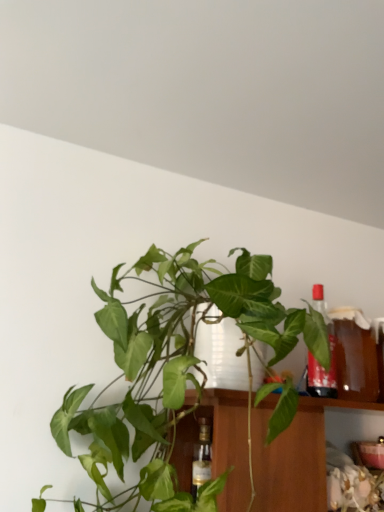
This screenshot has width=384, height=512. What do you see at coordinates (174, 365) in the screenshot? I see `green leafy plant at center` at bounding box center [174, 365].

Find the location of a particular element. The height and width of the screenshot is (512, 384). green leafy plant at center is located at coordinates (174, 365).

Where is `translucent glass bottle at upper right`? translucent glass bottle at upper right is located at coordinates (317, 361).

The width and height of the screenshot is (384, 512). What do you see at coordinates (317, 361) in the screenshot?
I see `translucent glass bottle at upper right` at bounding box center [317, 361].

Find the location of a particular element. The height and width of the screenshot is (512, 384). green leafy plant at center is located at coordinates (174, 365).

Does green leafy plant at center appear on the left side of translucent glass bottle at upper right?

Yes, green leafy plant at center is to the left of translucent glass bottle at upper right.

Consider the image. In the image, is green leafy plant at center positioned in front of or behind translucent glass bottle at upper right?

Clearly, green leafy plant at center is in front of translucent glass bottle at upper right.

Between point (205, 266) and point (308, 367), which one is positioned in front?

The point (308, 367) is in front.

From the image's perspective, is green leafy plant at center beneath translucent glass bottle at upper right?

No, from the image's perspective, green leafy plant at center is not below translucent glass bottle at upper right.

From a real-world perspective, is green leafy plant at center over translucent glass bottle at upper right?

No, from a real-world perspective, green leafy plant at center is not above translucent glass bottle at upper right.

Considering the sizes of objects green leafy plant at center and translucent glass bottle at upper right in the image provided, who is wider, green leafy plant at center or translucent glass bottle at upper right?

green leafy plant at center is wider.

Based on the photo, can you confirm if green leafy plant at center is taller than translucent glass bottle at upper right?

Indeed, green leafy plant at center has a greater height compared to translucent glass bottle at upper right.

Can you confirm if green leafy plant at center is smaller than translucent glass bottle at upper right?

No, green leafy plant at center is not smaller than translucent glass bottle at upper right.

Is green leafy plant at center not within translucent glass bottle at upper right?

Yes, green leafy plant at center is outside of translucent glass bottle at upper right.

Is green leafy plant at center beside translucent glass bottle at upper right?

No, green leafy plant at center is not with translucent glass bottle at upper right.

Is green leafy plant at center facing away from translucent glass bottle at upper right?

No, green leafy plant at center is not facing away from translucent glass bottle at upper right.

How much distance is there between green leafy plant at center and translucent glass bottle at upper right?

A distance of 14.21 inches exists between green leafy plant at center and translucent glass bottle at upper right.

This screenshot has height=512, width=384. Find the location of `houseplant below the translucent glass bottle at upper right (from a real-world perspective)`. houseplant below the translucent glass bottle at upper right (from a real-world perspective) is located at coordinates (174, 365).

Visually, is translucent glass bottle at upper right positioned to the left or to the right of green leafy plant at center?

translucent glass bottle at upper right is to the right of green leafy plant at center.

Which object is further away from the camera, translucent glass bottle at upper right or green leafy plant at center?

translucent glass bottle at upper right.

Between point (322, 380) and point (130, 408), which one is positioned behind?

The point (322, 380) is farther.

From the image's perspective, does translucent glass bottle at upper right appear lower than green leafy plant at center?

Yes.

From a real-world perspective, is translucent glass bottle at upper right located higher than green leafy plant at center?

Yes.

Considering the sizes of translucent glass bottle at upper right and green leafy plant at center in the image, is translucent glass bottle at upper right wider or thinner than green leafy plant at center?

In the image, translucent glass bottle at upper right appears to be more narrow than green leafy plant at center.

Does translucent glass bottle at upper right have a greater height compared to green leafy plant at center?

No.

Can you confirm if translucent glass bottle at upper right is smaller than green leafy plant at center?

Yes.

Is translucent glass bottle at upper right outside of green leafy plant at center?

Absolutely, translucent glass bottle at upper right is external to green leafy plant at center.

Is translucent glass bottle at upper right beside green leafy plant at center?

No, translucent glass bottle at upper right is not next to green leafy plant at center.

Is translucent glass bottle at upper right looking in the opposite direction of green leafy plant at center?

translucent glass bottle at upper right is not turned away from green leafy plant at center.

Find the location of `bottle that is below the green leafy plant at center (from the image's perspective)`. bottle that is below the green leafy plant at center (from the image's perspective) is located at coordinates (317, 361).

Where is `bottle located below the green leafy plant at center (from the image's perspective)`? The width and height of the screenshot is (384, 512). bottle located below the green leafy plant at center (from the image's perspective) is located at coordinates (317, 361).

Locate an element on the screen. This screenshot has width=384, height=512. bottle above the green leafy plant at center (from a real-world perspective) is located at coordinates (317, 361).